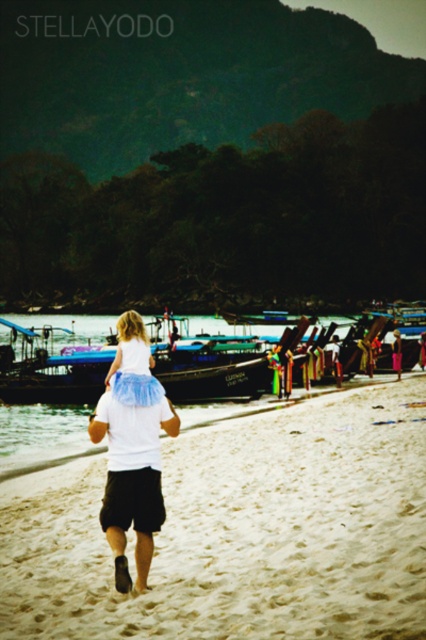
You are a photographer trying to capture a photo of the wooden boat at center and the white matte shirt at center. You want to ensure both are fully visible in the frame. Based on their sizes, which object should you prioritize positioning closer to the camera to avoid cropping?

The wooden boat at center might be wider than white matte shirt at center, so you should prioritize positioning the wooden boat at center closer to the camera to ensure it fits within the frame without cropping.

You are a photographer planning to capture the entire scene of the white sandy beach at center and the wooden boat at center in one shot. Based on their sizes, which object would require you to step back more to include both fully in the frame?

The wooden boat at center is wider than the white sandy beach at center, so you would need to step back more to include the wooden boat at center fully in the frame.